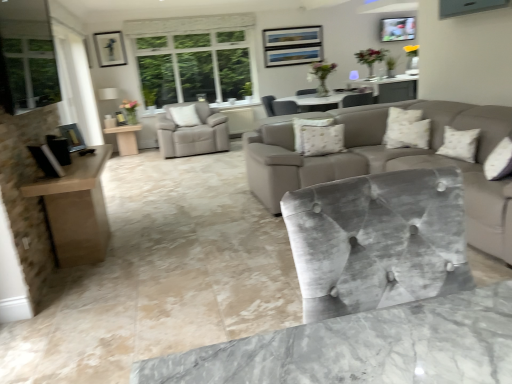
Question: Considering their positions, is white textured pillow at center, which is the second pillow in front-to-back order, located in front of or behind white textured pillow at upper right, which is counted as the 3th pillow, starting from the left?

Choices:
 (A) front
 (B) behind

Answer: (B)

Question: From a real-world perspective, is white textured pillow at center, the third pillow in the top-to-bottom sequence, physically located above or below white textured pillow at upper right, which is the 3th pillow from back to front?

Choices:
 (A) below
 (B) above

Answer: (B)

Question: Which is nearer to the clear glass window at left?

Choices:
 (A) white textured pillow at upper right, the second pillow in the top-to-bottom sequence
 (B) matte black picture frame at upper left, placed as the 1th picture frame when sorted from bottom to top
 (C) white textured pillow at center, the first pillow when ordered from bottom to top
 (D) metallic silver picture frame at upper right, acting as the second picture frame starting from the bottom
 (E) velvet gray chair at center, which appears as the first chair when viewed from the front

Answer: (B)

Question: Estimate the real-world distances between objects in this image. Which object is closer to the matte beige table at center?

Choices:
 (A) light beige leather armchair at center, the 3th chair viewed from the front
 (B) velvet grey chair at center, placed as the 3th chair when sorted from left to right
 (C) white textured pillow at upper right, the second pillow in the top-to-bottom sequence
 (D) matte black picture frame at upper left, which appears as the 2th picture frame when viewed from the right
 (E) clear glass window at left

Answer: (A)